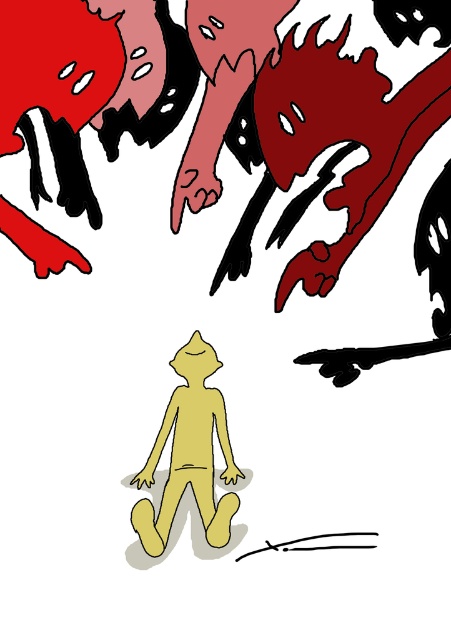
This screenshot has width=451, height=640. Describe the element at coordinates (302, 120) in the screenshot. I see `smooth red zombie at upper right` at that location.

Which of these two, smooth red zombie at upper right or yellow matte figure at center, stands shorter?

yellow matte figure at center is shorter.

Where is `smooth red zombie at upper right`? This screenshot has height=640, width=451. smooth red zombie at upper right is located at coordinates (302, 120).